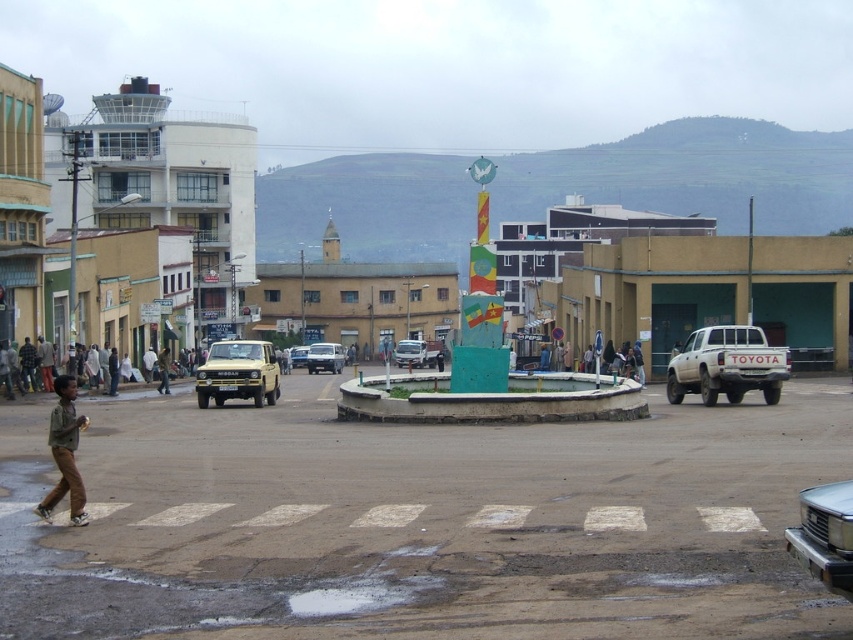
You are a city planner reviewing the urban layout. The monument with teal base and colorful panels is located at the center of the green concrete plaza at center. Where exactly is the monument positioned in terms of coordinates?

The monument is positioned at the center of the green concrete plaza at center, which is located at coordinates point (x=421, y=522).